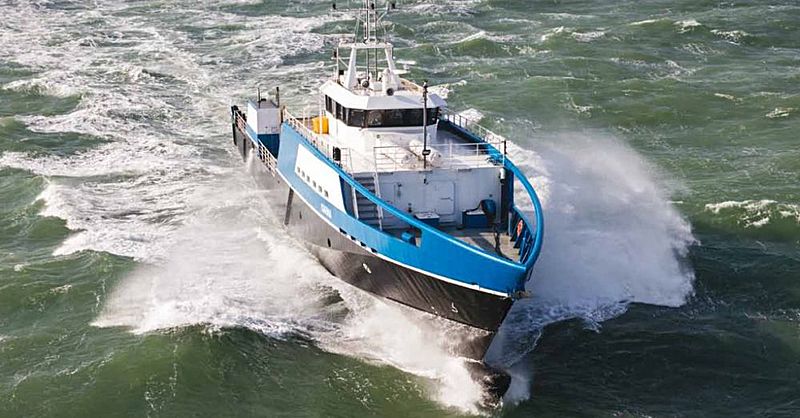
Find the location of `stairs`. stairs is located at coordinates (362, 207).